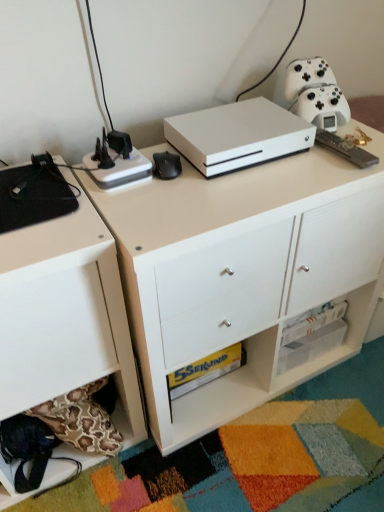
Where is `free space in front of black plastic power strip at upper left, which is the 3th appliance from right to left`? Image resolution: width=384 pixels, height=512 pixels. free space in front of black plastic power strip at upper left, which is the 3th appliance from right to left is located at coordinates (137, 215).